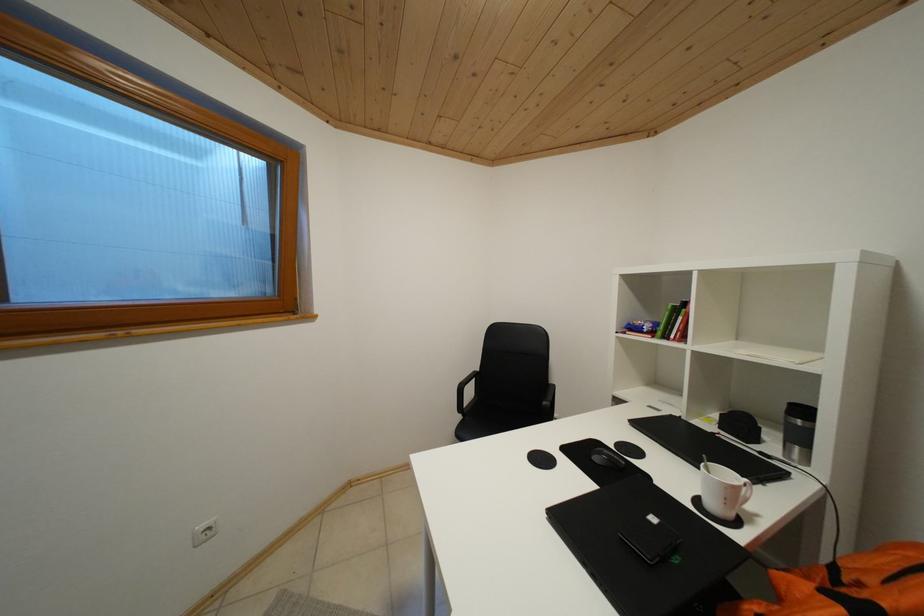
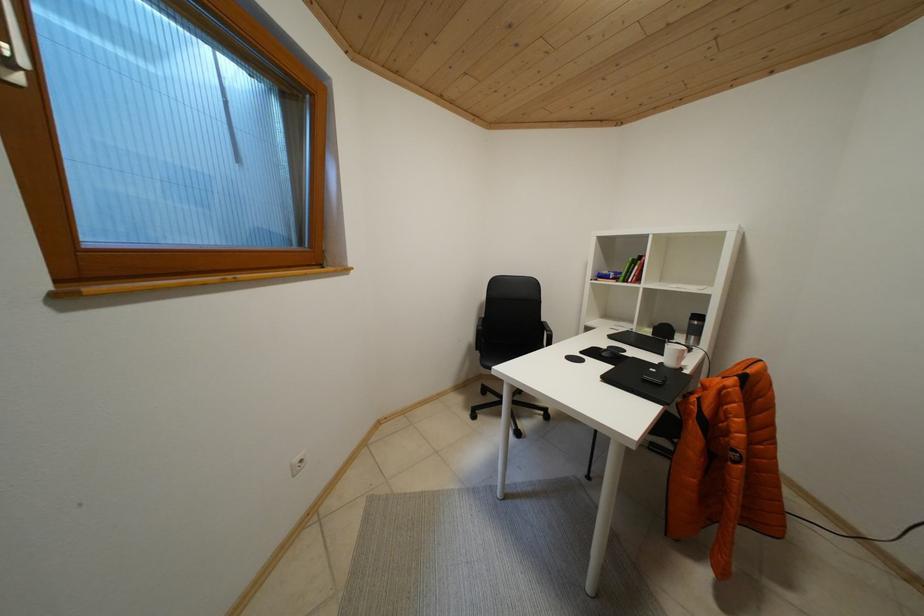
Question: The images are taken continuously from a first-person perspective. In which direction are you moving?

Choices:
 (A) Left
 (B) Right
 (C) Forward
 (D) Backward

Answer: (A)